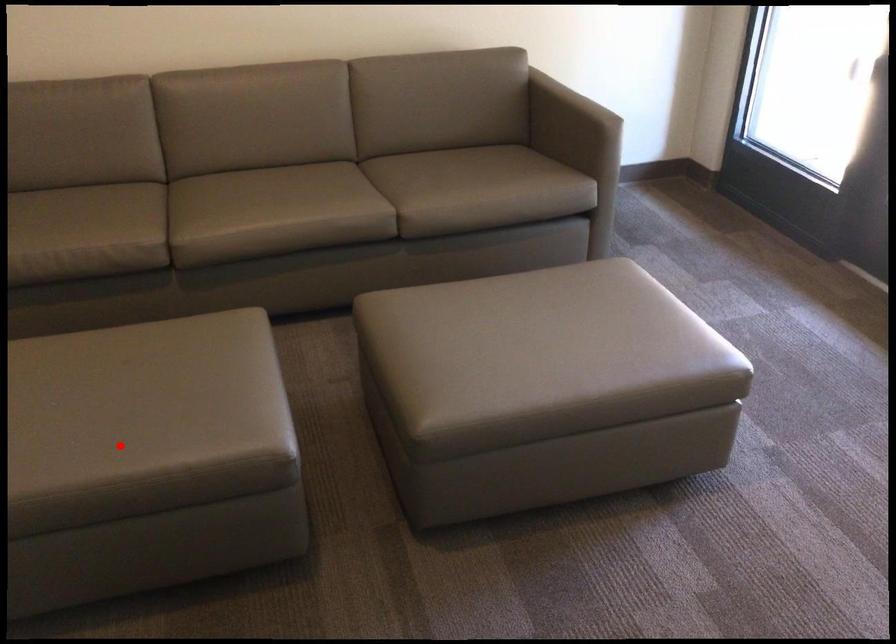
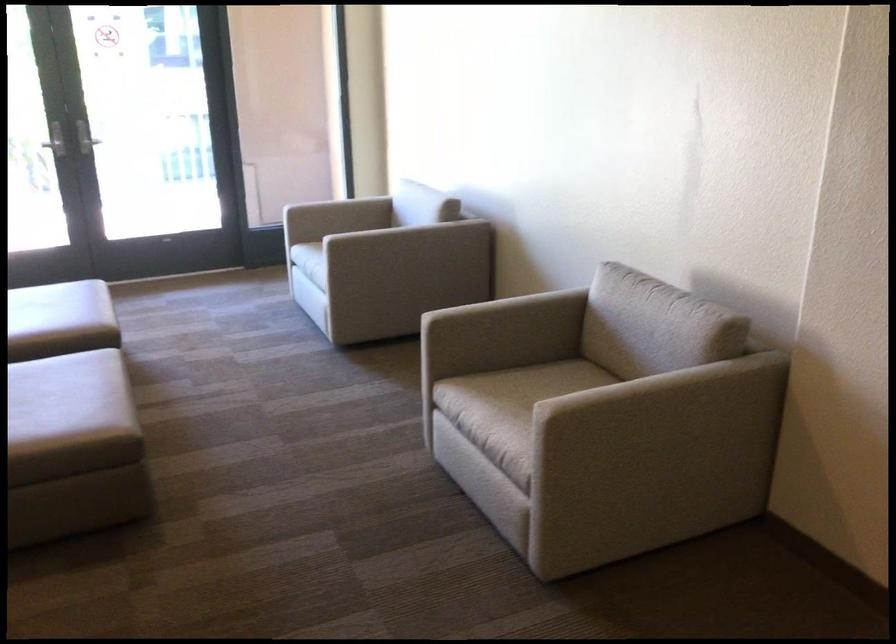
Question: A red point is marked in image1. In image2, is the corresponding 3D point closer to the camera or farther? Reply with the corresponding letter.

Choices:
 (A) The corresponding 3D point is closer.
 (B) The corresponding 3D point is farther.

Answer: (B)